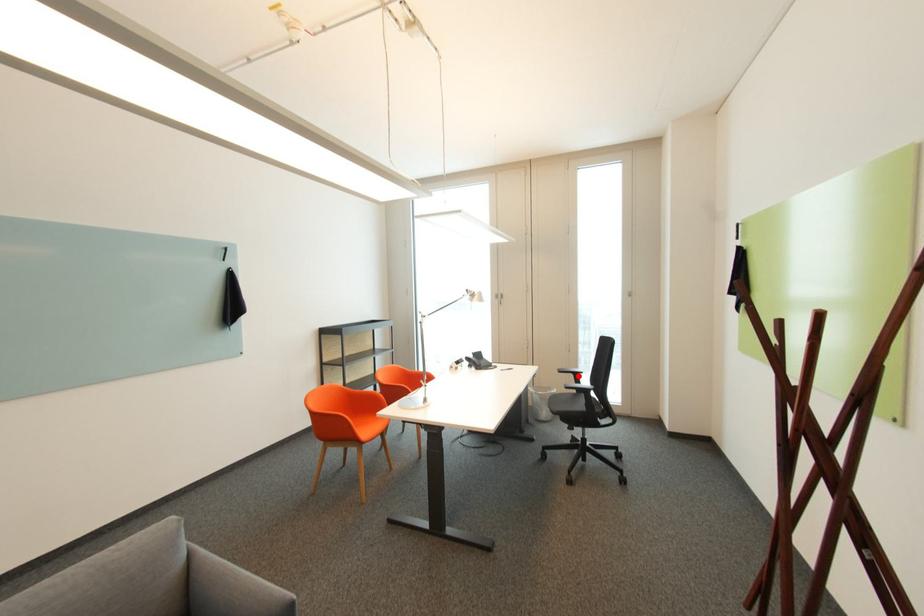
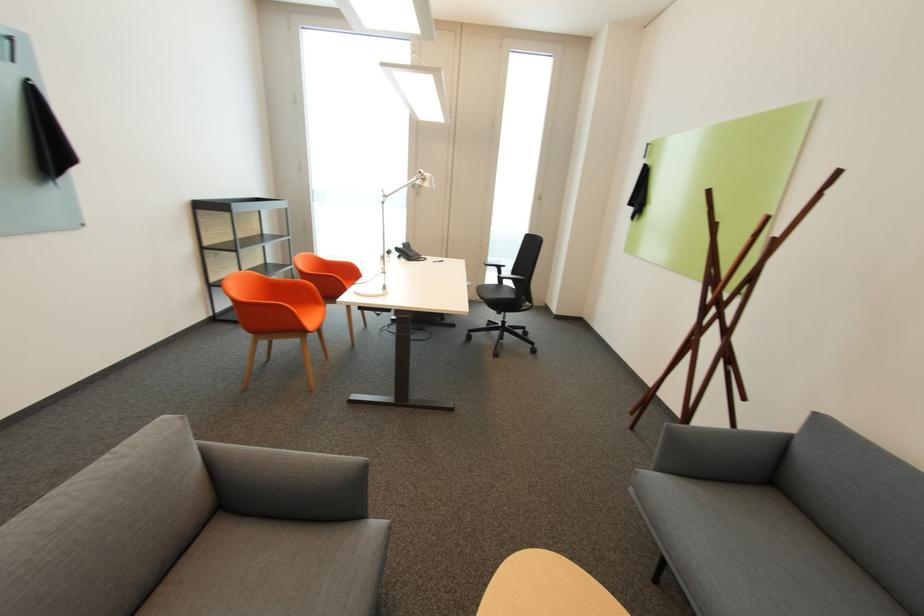
Question: I am providing you with two images of the same scene from different viewpoints. A red point is marked on the first image. Is the red point's position out of view in image 2?

Choices:
 (A) Yes
 (B) No

Answer: (B)